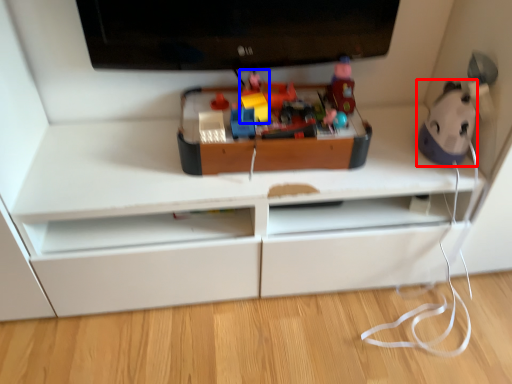
Question: Which of the following is the closest to the observer, toy (highlighted by a red box) or toy (highlighted by a blue box)?

Choices:
 (A) toy
 (B) toy

Answer: (A)